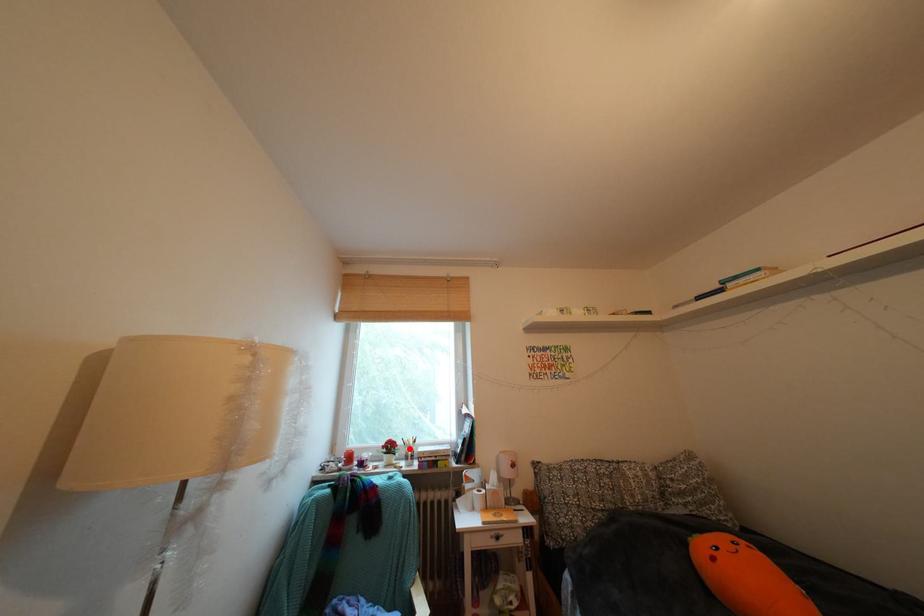
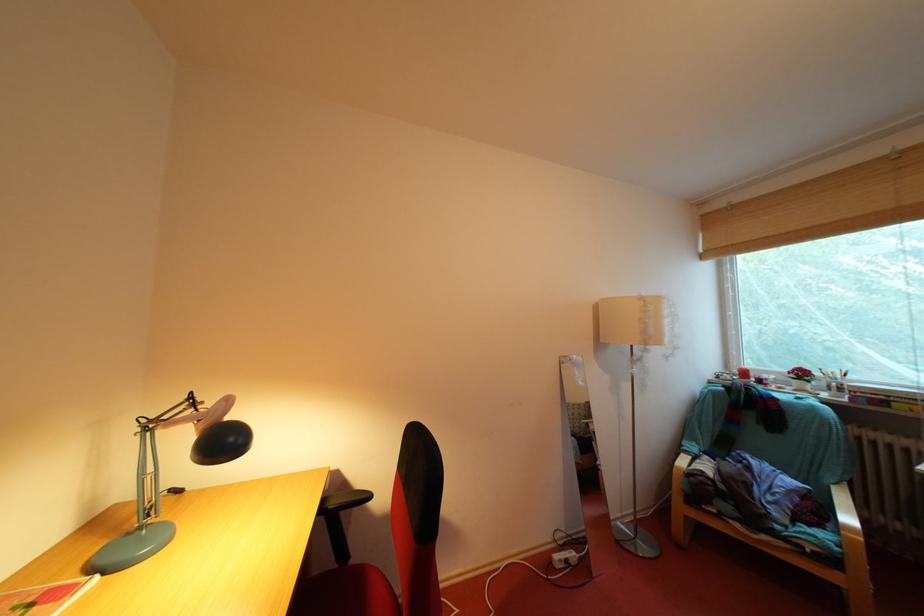
In the second image, find the point that corresponds to the highlighted location in the first image.

(829, 379)